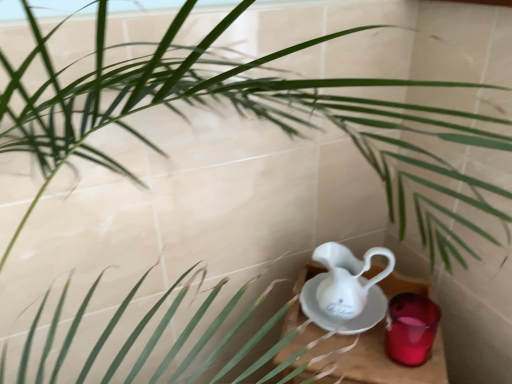
Question: Considering the relative sizes of translucent glass candle at lower right and white porcelain jug at lower right in the image provided, is translucent glass candle at lower right smaller than white porcelain jug at lower right?

Choices:
 (A) no
 (B) yes

Answer: (B)

Question: Are translucent glass candle at lower right and white porcelain jug at lower right beside each other?

Choices:
 (A) no
 (B) yes

Answer: (A)

Question: Can you confirm if translucent glass candle at lower right is thinner than white porcelain jug at lower right?

Choices:
 (A) yes
 (B) no

Answer: (A)

Question: Can you confirm if translucent glass candle at lower right is bigger than white porcelain jug at lower right?

Choices:
 (A) yes
 (B) no

Answer: (B)

Question: Is translucent glass candle at lower right positioned beyond the bounds of white porcelain jug at lower right?

Choices:
 (A) yes
 (B) no

Answer: (A)

Question: Would you say wooden table at lower right is inside or outside translucent glass candle at lower right?

Choices:
 (A) inside
 (B) outside

Answer: (B)

Question: Visually, is wooden table at lower right positioned to the left or to the right of translucent glass candle at lower right?

Choices:
 (A) right
 (B) left

Answer: (B)

Question: From their relative heights in the image, would you say wooden table at lower right is taller or shorter than translucent glass candle at lower right?

Choices:
 (A) short
 (B) tall

Answer: (B)

Question: From a real-world perspective, is wooden table at lower right positioned above or below translucent glass candle at lower right?

Choices:
 (A) below
 (B) above

Answer: (A)

Question: Is translucent glass candle at lower right to the left or to the right of wooden table at lower right in the image?

Choices:
 (A) left
 (B) right

Answer: (B)

Question: From the image's perspective, is translucent glass candle at lower right positioned above or below wooden table at lower right?

Choices:
 (A) below
 (B) above

Answer: (B)

Question: In terms of width, does translucent glass candle at lower right look wider or thinner when compared to wooden table at lower right?

Choices:
 (A) wide
 (B) thin

Answer: (B)

Question: Considering the positions of point (425, 314) and point (393, 289), is point (425, 314) closer or farther from the camera than point (393, 289)?

Choices:
 (A) farther
 (B) closer

Answer: (B)

Question: Is point (303, 271) closer or farther from the camera than point (330, 246)?

Choices:
 (A) closer
 (B) farther

Answer: (B)

Question: In terms of height, does wooden table at lower right look taller or shorter compared to white porcelain jug at lower right?

Choices:
 (A) tall
 (B) short

Answer: (A)